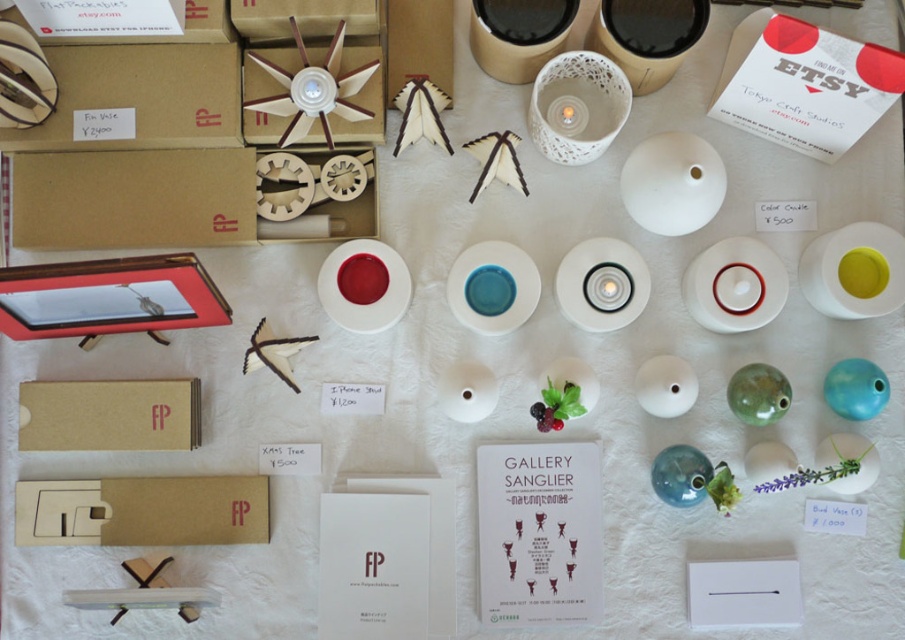
Question: Which point appears farthest from the camera in this image?

Choices:
 (A) (52, 166)
 (B) (826, 314)

Answer: (B)

Question: Which of the following is the farthest from the observer?

Choices:
 (A) (599, 252)
 (B) (179, 243)

Answer: (B)

Question: Is matte cardboard box at upper left bigger than yellow matte plate at center right?

Choices:
 (A) no
 (B) yes

Answer: (B)

Question: Is brown cardboard box at upper left smaller than blue glossy plate at center?

Choices:
 (A) yes
 (B) no

Answer: (B)

Question: Is the position of matte cardboard box at upper left less distant than that of brown cardboard box at lower left?

Choices:
 (A) yes
 (B) no

Answer: (A)

Question: Among these points, which one is farthest from the camera?

Choices:
 (A) (344, 300)
 (B) (593, 324)
 (C) (102, 380)
 (D) (40, 198)

Answer: (B)